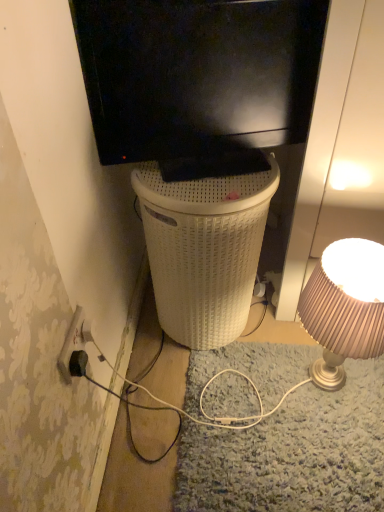
Question: Is black plastic power outlet at lower left bigger or smaller than white woven basket at center?

Choices:
 (A) big
 (B) small

Answer: (B)

Question: In the image, is black plastic power outlet at lower left on the left side or the right side of white woven basket at center?

Choices:
 (A) right
 (B) left

Answer: (B)

Question: Considering the real-world distances, which object is closest to the white woven basket at center?

Choices:
 (A) black plastic power outlet at lower left
 (B) matte beige lampshade at right
 (C) black matte television at upper center

Answer: (C)

Question: Considering the real-world distances, which object is farthest from the black plastic power outlet at lower left?

Choices:
 (A) white woven basket at center
 (B) black matte television at upper center
 (C) matte beige lampshade at right

Answer: (C)